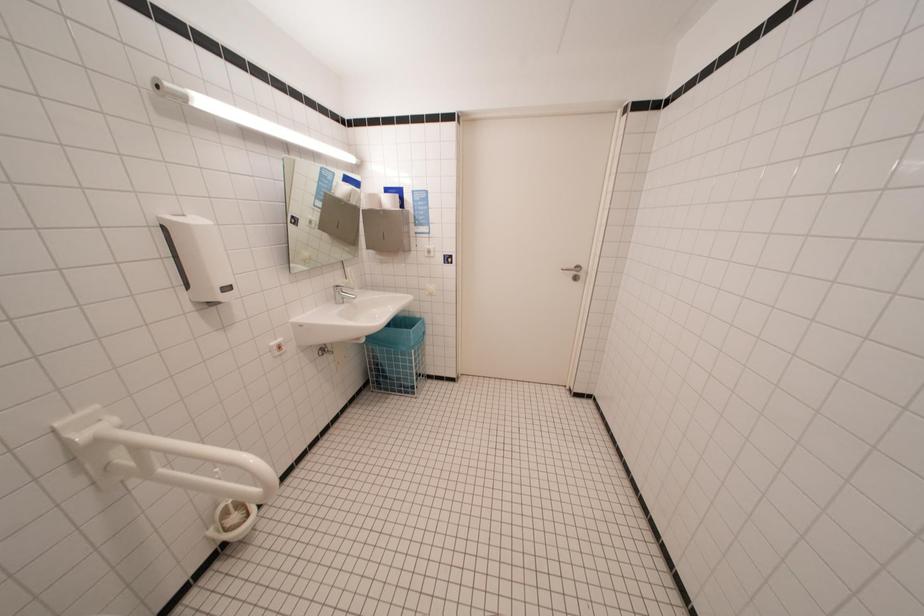
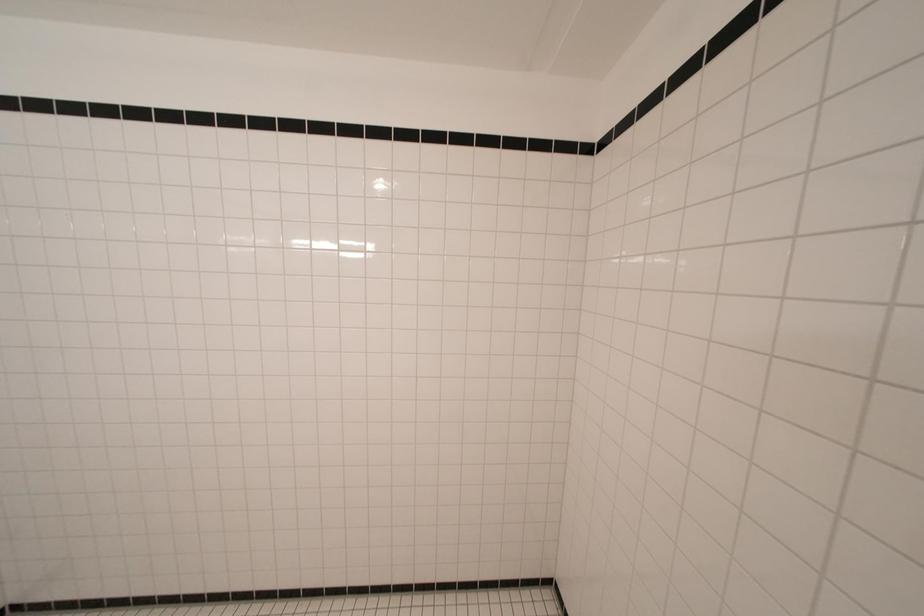
Question: The camera is either moving clockwise (left) or counter-clockwise (right) around the object. The first image is from the beginning of the video and the second image is from the end. Is the camera moving left or right when shooting the video?

Choices:
 (A) Left
 (B) Right

Answer: (A)